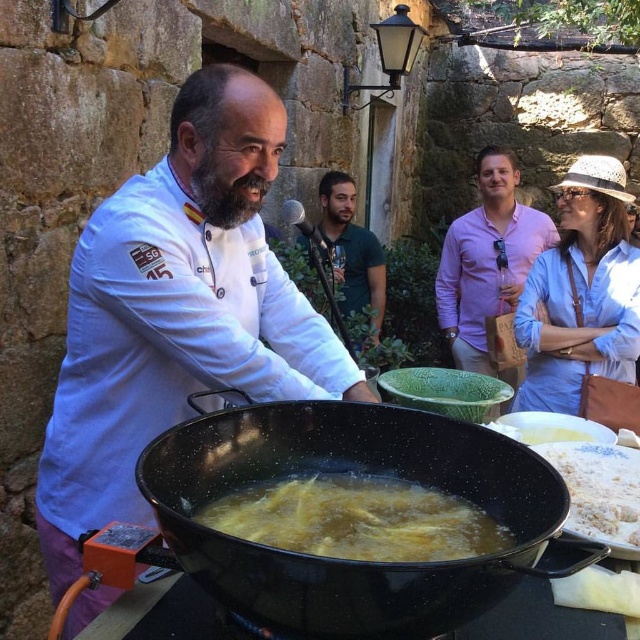
Which is below, white chef coat at center or yellow matte food at center?

yellow matte food at center is lower down.

Can you confirm if white chef coat at center is positioned above yellow matte food at center?

Correct, white chef coat at center is located above yellow matte food at center.

Is point (93, 500) farther from viewer compared to point (352, 484)?

That is True.

The width and height of the screenshot is (640, 640). I want to click on white chef coat at center, so click(177, 310).

Is yellow matte food at center to the right of white flour at lower right from the viewer's perspective?

Incorrect, yellow matte food at center is not on the right side of white flour at lower right.

Is point (390, 547) more distant than point (634, 497)?

No, (390, 547) is in front of (634, 497).

I want to click on yellow matte food at center, so click(x=356, y=518).

Who is positioned more to the right, black speckled wok at center or yellow matte food at center?

black speckled wok at center

Is black speckled wok at center taller than yellow matte food at center?

Yes, black speckled wok at center is taller than yellow matte food at center.

Who is more distant from viewer, (x=428, y=436) or (x=509, y=545)?

The point (x=428, y=436) is more distant.

You are a GUI agent. You are given a task and a screenshot of the screen. Output one action in this format:
    pyautogui.click(x=<x>, y=<y>)
    Task: Click on the black speckled wok at center
    
    Given the screenshot: What is the action you would take?
    pyautogui.click(x=355, y=474)